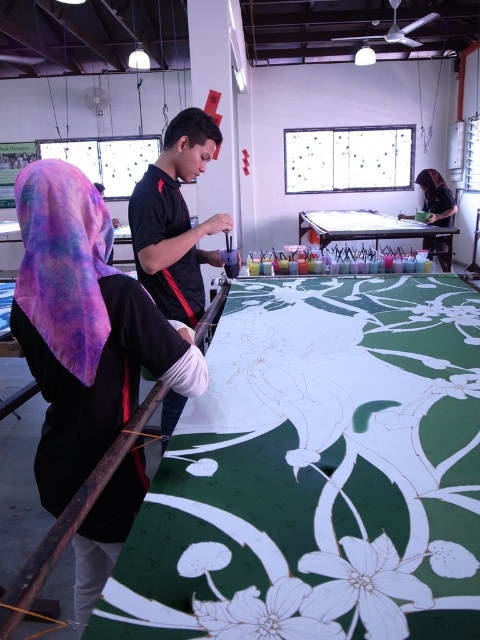
Can you confirm if black fabric at center is thinner than black jersey at center?

No.

This screenshot has width=480, height=640. Describe the element at coordinates (84, 326) in the screenshot. I see `black fabric at center` at that location.

At what (x,y) coordinates should I click in order to perform the action: click on black fabric at center. Please return your answer as a coordinate pair (x, y). Image resolution: width=480 pixels, height=640 pixels. Looking at the image, I should click on (84, 326).

The image size is (480, 640). Find the location of `black fabric at center`. black fabric at center is located at coordinates (84, 326).

Is multicolored fabric shawl at left in front of matte black laptop at upper right?

Yes, multicolored fabric shawl at left is in front of matte black laptop at upper right.

Is point (108, 230) farther from camera compared to point (427, 241)?

No, it is not.

Find the location of `multicolored fabric shawl at left`. multicolored fabric shawl at left is located at coordinates (63, 262).

Which is above, black jersey at center or matte black laptop at upper right?

matte black laptop at upper right

Between black jersey at center and matte black laptop at upper right, which one appears on the right side from the viewer's perspective?

matte black laptop at upper right

Is point (202, 134) closer to camera compared to point (441, 177)?

Yes.

At what (x,y) coordinates should I click in order to perform the action: click on black jersey at center. Please return your answer as a coordinate pair (x, y). Looking at the image, I should click on (176, 220).